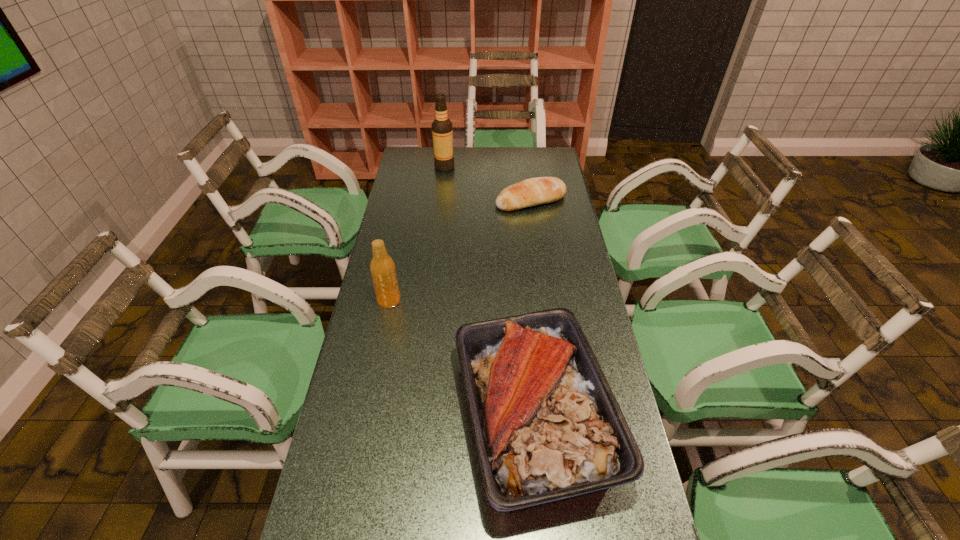
You are a GUI agent. You are given a task and a screenshot of the screen. Output one action in this format:
    pyautogui.click(x=<x>, y=<y>)
    Task: Click on the vacant space at the right edge of the desktop
    The height and width of the screenshot is (540, 960).
    Given the screenshot: What is the action you would take?
    pyautogui.click(x=540, y=215)

Locate an element on the screen. This screenshot has height=540, width=960. vacant space at the far right corner of the desktop is located at coordinates (540, 155).

The image size is (960, 540). What are the coordinates of `free spot between the second object from left to right and the bread` in the screenshot? It's located at click(x=488, y=184).

I want to click on free spot between the farthest object and the shortest object, so click(x=488, y=184).

This screenshot has width=960, height=540. I want to click on free space between the bread and the leftmost object, so click(460, 251).

I want to click on vacant point located between the beer bottle and the second object from left to right, so click(417, 233).

Select which object is the second closest to the tallest object. Please provide its 2D coordinates. Your answer should be formatted as a tuple, i.e. [(x, y)], where the tuple contains the x and y coordinates of a point satisfying the conditions above.

[(382, 267)]

Select which object appears as the third closest to the third shortest object. Please provide its 2D coordinates. Your answer should be formatted as a tuple, i.e. [(x, y)], where the tuple contains the x and y coordinates of a point satisfying the conditions above.

[(442, 131)]

Image resolution: width=960 pixels, height=540 pixels. I want to click on free space that satisfies the following two spatial constraints: 1. on the back side of the third nearest object; 2. on the right side of the leftmost object, so coord(409,201).

Where is `free location that satisfies the following two spatial constraints: 1. on the label of the second object from left to right; 2. on the back side of the second farthest object`? This screenshot has width=960, height=540. free location that satisfies the following two spatial constraints: 1. on the label of the second object from left to right; 2. on the back side of the second farthest object is located at coordinates (441, 201).